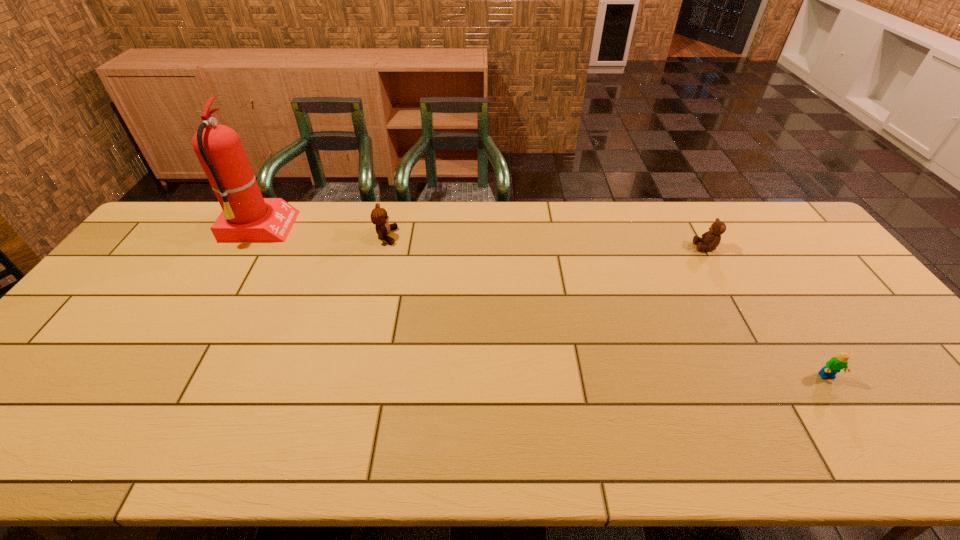
Identify the location of free space that is in between the left teddy bear and the tallest object. The height and width of the screenshot is (540, 960). (323, 232).

Where is `vacant space that is in between the third object from left to right and the tallest object`? The width and height of the screenshot is (960, 540). vacant space that is in between the third object from left to right and the tallest object is located at coordinates (482, 238).

Locate an element on the screen. free space between the third object from left to right and the second object from left to right is located at coordinates (546, 241).

I want to click on free space between the third object from left to right and the third object from right to left, so click(546, 241).

At what (x,y) coordinates should I click in order to perform the action: click on vacant region between the Lego and the fire extinguisher. Please return your answer as a coordinate pair (x, y). Looking at the image, I should click on (543, 302).

Find the location of a particular element. The width and height of the screenshot is (960, 540). empty space that is in between the left teddy bear and the rightmost object is located at coordinates (607, 307).

This screenshot has height=540, width=960. In order to click on free spot between the shorter teddy bear and the third object from right to left in this screenshot , I will do `click(546, 241)`.

At what (x,y) coordinates should I click in order to perform the action: click on free spot between the Lego and the second object from right to left. Please return your answer as a coordinate pair (x, y). Looking at the image, I should click on (766, 312).

Identify the location of empty space between the tallest object and the second object from left to right. This screenshot has width=960, height=540. (323, 232).

You are a GUI agent. You are given a task and a screenshot of the screen. Output one action in this format:
    pyautogui.click(x=<x>, y=<y>)
    Task: Click on the object that stands as the third closest to the fire extinguisher
    
    Given the screenshot: What is the action you would take?
    pyautogui.click(x=835, y=364)